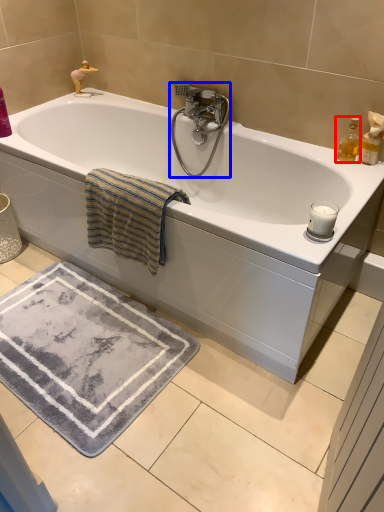
Question: Which point is further to the camera, soap dispenser (highlighted by a red box) or tap (highlighted by a blue box)?

Choices:
 (A) soap dispenser
 (B) tap

Answer: (B)